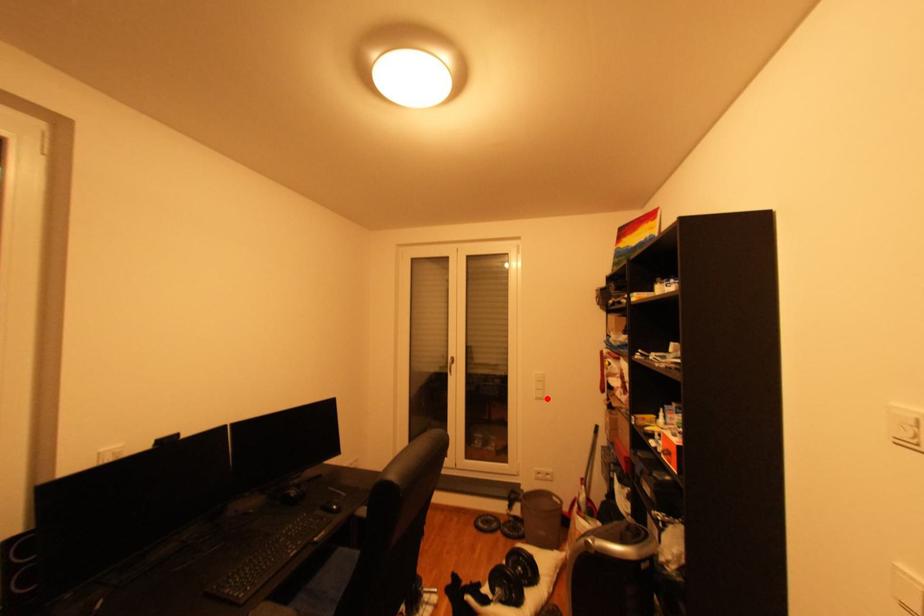
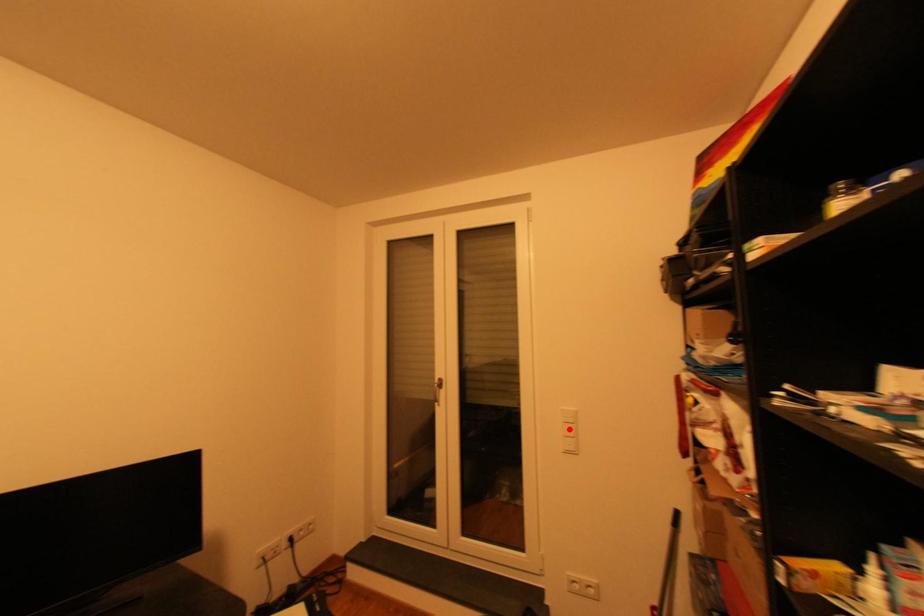
I am providing you with two images of the same scene from different viewpoints. A red point is marked on the first image and another point is marked on the second image. Do the highlighted points in image1 and image2 indicate the same real-world spot?

No